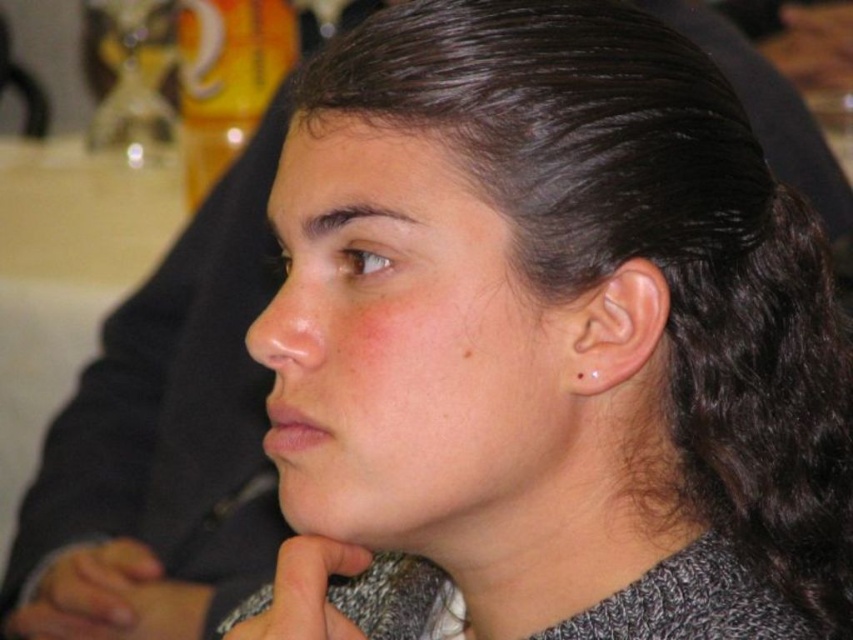
Question: Which of the following is the closest to the observer?

Choices:
 (A) gray knitted sweater at lower left
 (B) gray knitted sweater at lower center

Answer: (B)

Question: Among these objects, which one is nearest to the camera?

Choices:
 (A) gray knitted sweater at lower left
 (B) gray knitted sweater at lower center

Answer: (B)

Question: Is the position of gray knitted sweater at lower left more distant than that of gray knitted sweater at lower center?

Choices:
 (A) yes
 (B) no

Answer: (A)

Question: From the image, what is the correct spatial relationship of gray knitted sweater at lower left in relation to gray knitted sweater at lower center?

Choices:
 (A) below
 (B) above

Answer: (A)

Question: Is gray knitted sweater at lower left to the right of gray knitted sweater at lower center from the viewer's perspective?

Choices:
 (A) no
 (B) yes

Answer: (A)